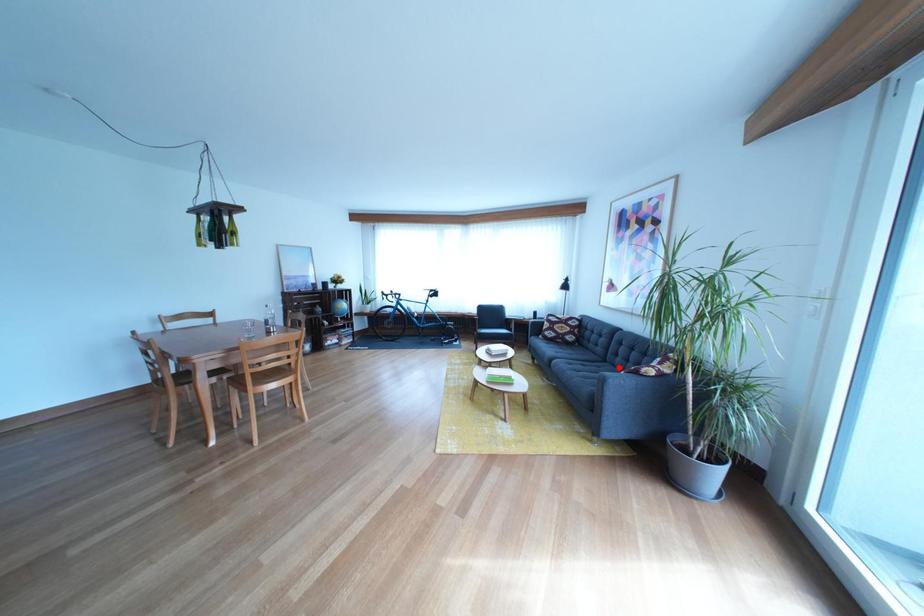
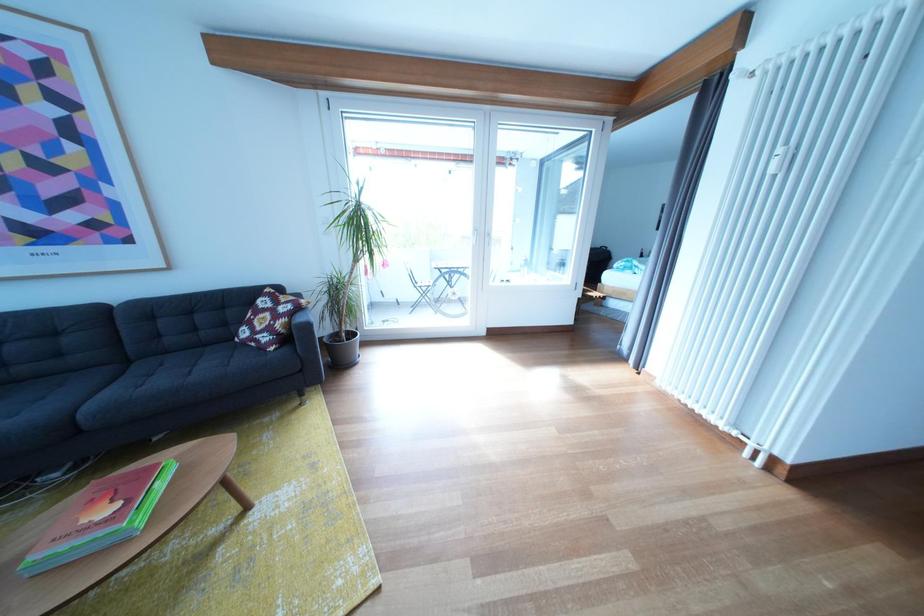
Locate, in the second image, the point that corresponds to the highlighted location in the first image.

(141, 368)